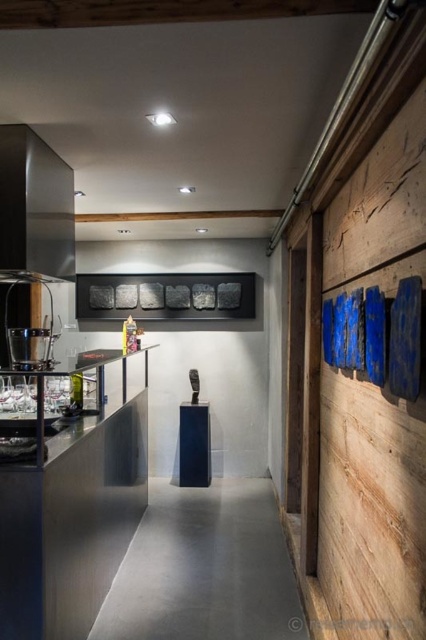
Question: Among these objects, which one is nearest to the camera?

Choices:
 (A) satin black exhaust hood at upper left
 (B) brushed metal coffee machine at left
 (C) stainless steel counter at left

Answer: (C)

Question: Does stainless steel counter at left lie behind satin black exhaust hood at upper left?

Choices:
 (A) no
 (B) yes

Answer: (A)

Question: Does stainless steel counter at left have a smaller size compared to satin black exhaust hood at upper left?

Choices:
 (A) yes
 (B) no

Answer: (B)

Question: Which point appears closest to the camera in this image?

Choices:
 (A) (34, 364)
 (B) (66, 248)

Answer: (A)

Question: Is satin black exhaust hood at upper left bigger than brushed metal coffee machine at left?

Choices:
 (A) yes
 (B) no

Answer: (A)

Question: Which of the following is the closest to the observer?

Choices:
 (A) brushed metal coffee machine at left
 (B) stainless steel counter at left

Answer: (B)